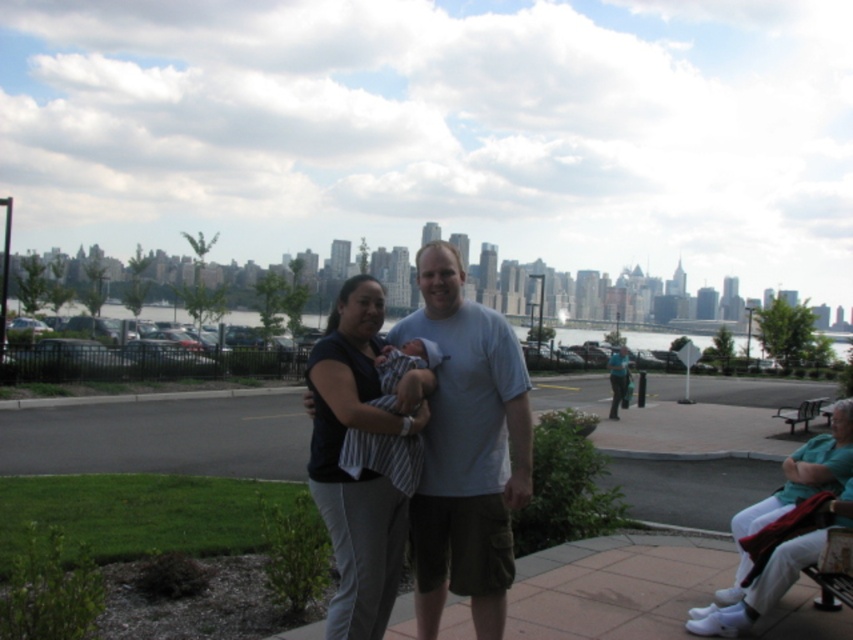
Question: Does dark blue fabric shirt at center appear under matte white shirt at center?

Choices:
 (A) yes
 (B) no

Answer: (B)

Question: Among these points, which one is nearest to the camera?

Choices:
 (A) (624, 376)
 (B) (802, 403)
 (C) (418, 445)

Answer: (C)

Question: Where is matte white shirt at center located in relation to metallic silver bench at lower right in the image?

Choices:
 (A) below
 (B) above

Answer: (B)

Question: Is dark blue fabric shirt at center behind striped fabric baby at center?

Choices:
 (A) yes
 (B) no

Answer: (A)

Question: Which of these objects is positioned farthest from the dark blue fabric shirt at center?

Choices:
 (A) striped fabric baby at center
 (B) metallic silver bench at lower right

Answer: (B)

Question: Which is farther from the matte white shirt at center?

Choices:
 (A) metallic silver bench at lower right
 (B) dark blue fabric shirt at center
 (C) striped fabric baby at center
 (D) light blue t-shirt at center

Answer: (C)